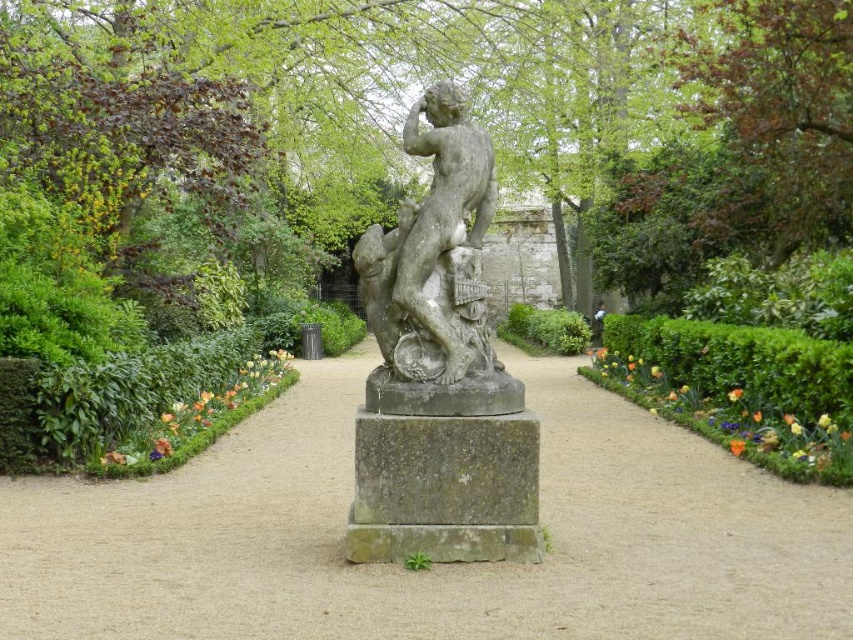
You are a gardener who needs to place a new decorative fountain between the gray stone path at center and the gray stone statue at center. The fountain requires a minimum of 10 feet of space to be placed safely. Based on the scene, can you determine if there is enough space between them to install the fountain?

The distance between the gray stone path at center and the gray stone statue at center is 8.86 feet. Since the fountain requires a minimum of 10 feet of space, there is not enough space to safely install the fountain between them.

You are standing at the garden entrance and want to reach the classical stone sculpture. Which direction should you walk to follow the gray stone path at center?

Walk straight ahead along the gray stone path at center to reach the classical stone sculpture.

You are a gardener planning to place a new 2.5 meter wide flower bed between the gray stone path at center and the gray stone statue at center. Given their widths, which one should the flower bed be placed next to to ensure it fits properly?

The gray stone path at center has a larger width than the gray stone statue at center. Therefore, the flower bed should be placed next to the gray stone path at center since its width is sufficient to accommodate the 2.5 meter flower bed.